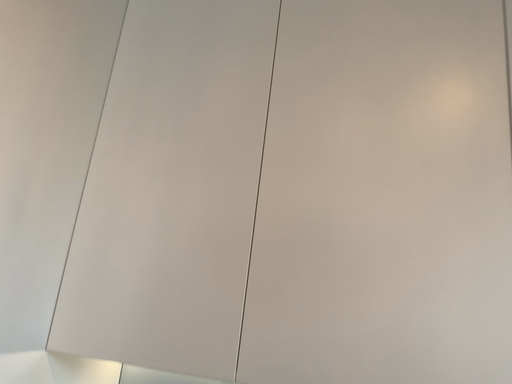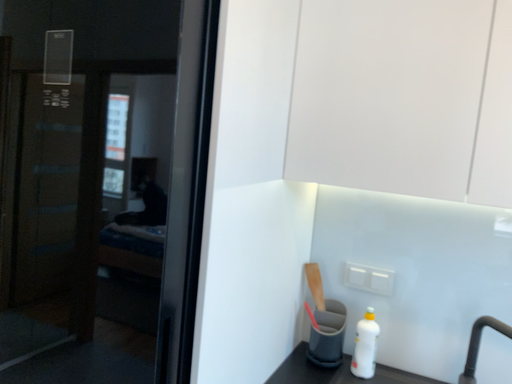
Question: How did the camera likely rotate when shooting the video?

Choices:
 (A) rotated right
 (B) rotated left

Answer: (B)